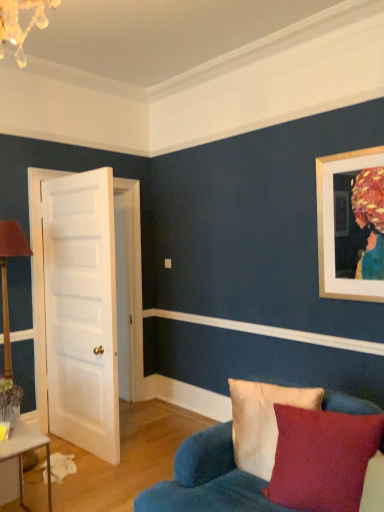
The height and width of the screenshot is (512, 384). I want to click on vacant area located to the right-hand side of white smooth door at left, so click(143, 453).